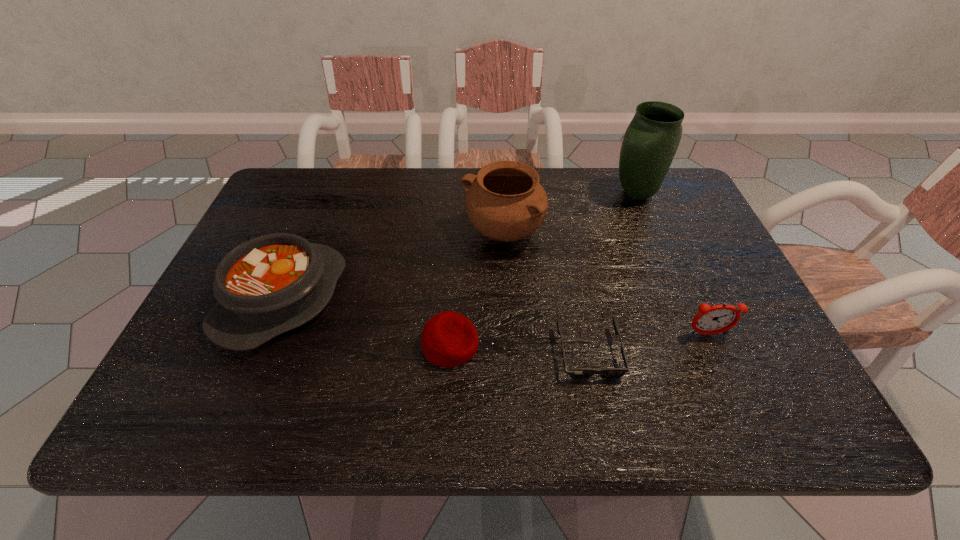
Identify the location of the farthest object. The image size is (960, 540). (651, 140).

I want to click on the tallest object, so click(651, 140).

Locate an element on the screen. This screenshot has height=540, width=960. pottery is located at coordinates (505, 202).

Identify the location of the leftmost object. The height and width of the screenshot is (540, 960). (268, 285).

This screenshot has height=540, width=960. Identify the location of alarm clock. (710, 320).

Find the location of a particular element. beanbag is located at coordinates (449, 339).

Where is `the shortest object`? This screenshot has width=960, height=540. the shortest object is located at coordinates (575, 373).

The image size is (960, 540). What are the coordinates of `vacant space situated on the front of the farthest object` in the screenshot? It's located at (684, 311).

At what (x,y) coordinates should I click in order to perform the action: click on vacant region located 0.290m on the left of the pottery. Please return your answer as a coordinate pair (x, y). This screenshot has height=540, width=960. Looking at the image, I should click on (354, 232).

Locate an element on the screen. This screenshot has height=540, width=960. vacant space located 0.170m on the right of the leftmost object is located at coordinates (414, 299).